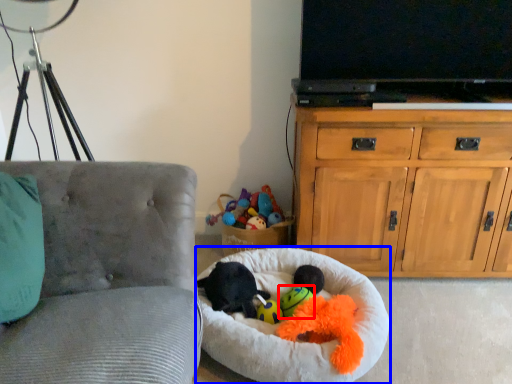
Question: Which object is closer to the camera taking this photo, toy (highlighted by a red box) or dog bed (highlighted by a blue box)?

Choices:
 (A) toy
 (B) dog bed

Answer: (B)